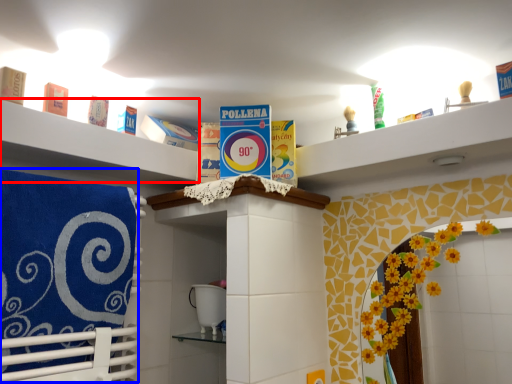
Question: Among these objects, which one is farthest to the camera, shelf (highlighted by a red box) or beach towel (highlighted by a blue box)?

Choices:
 (A) shelf
 (B) beach towel

Answer: (A)